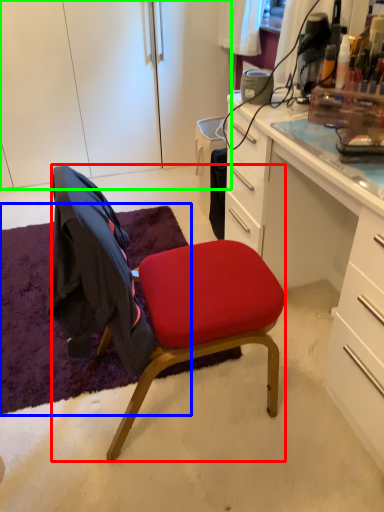
Question: Which object is positioned closest to chair (highlighted by a red box)? Select from mat (highlighted by a blue box) and cabinetry (highlighted by a green box).

Choices:
 (A) mat
 (B) cabinetry

Answer: (A)